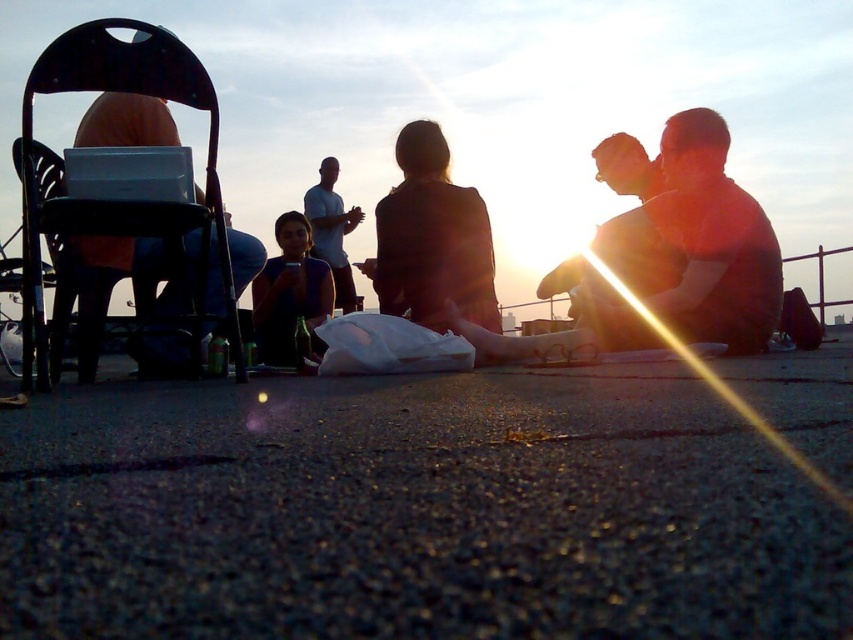
You are a delivery robot with a 2.5 meter long package that needs to be transported from the black plastic chair at left to the white cotton shirt at center. Can you move the package directly between them without needing to rotate it?

The distance between the black plastic chair at left and the white cotton shirt at center is 3.74 meters. Since the package is 2.5 meters long, it can be moved directly between them without rotation as the distance is sufficient.

You are a photographer trying to capture a clear shot of both the silhouette fabric jacket at center and the matte black shirt at center. Since the subjects are at different distances, which one should you focus on first to ensure both are in focus?

Focus on the silhouette fabric jacket at center first because it is closer to you than the matte black shirt at center. By focusing on the closer object, the depth of field may extend to include the farther one, ensuring both are in focus.